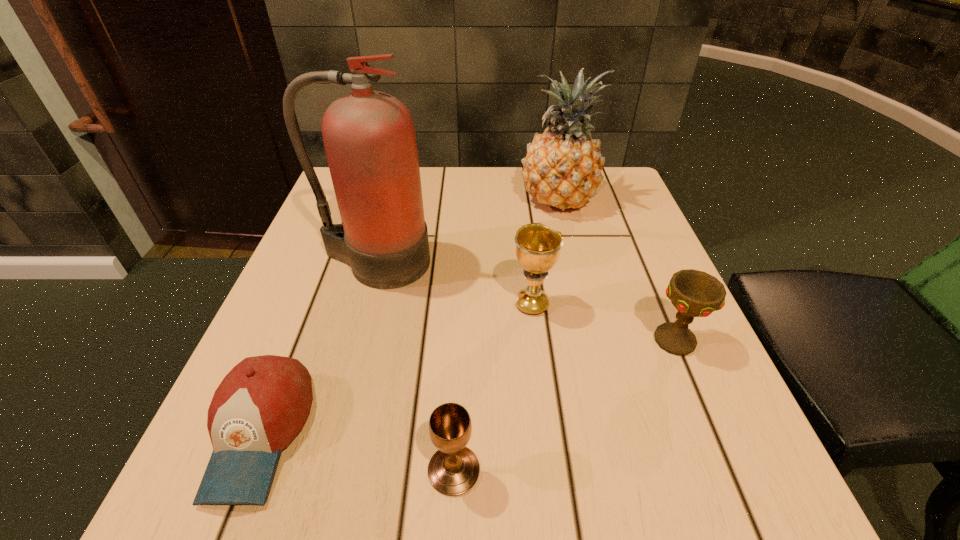
Image resolution: width=960 pixels, height=540 pixels. What are the coordinates of `free space between the nearest chalice and the tallest chalice` in the screenshot? It's located at (492, 387).

Locate an element on the screen. The height and width of the screenshot is (540, 960). free space between the shortest object and the second chalice from right to left is located at coordinates (396, 369).

Identify the location of free space between the leftmost chalice and the rightmost chalice. (564, 406).

Where is `vacant area that lies between the farthest chalice and the rightmost chalice`? The image size is (960, 540). vacant area that lies between the farthest chalice and the rightmost chalice is located at coordinates (603, 322).

The width and height of the screenshot is (960, 540). I want to click on vacant area between the third object from left to right and the farthest chalice, so click(x=492, y=387).

Locate an element on the screen. vacant space that's between the leftmost chalice and the farthest chalice is located at coordinates (492, 387).

Find the location of a particular element. unoccupied position between the baseball cap and the second nearest chalice is located at coordinates click(x=467, y=387).

You are a GUI agent. You are given a task and a screenshot of the screen. Output one action in this format:
    pyautogui.click(x=<x>, y=<y>)
    Task: Click on the blank region between the pineapple and the baseball cap
    The width and height of the screenshot is (960, 540).
    Given the screenshot: What is the action you would take?
    pyautogui.click(x=409, y=318)

Identify the location of object that stands as the third closest to the rightmost object. This screenshot has height=540, width=960. (453, 470).

Identify which object is the second closest to the shortest object. Please provide its 2D coordinates. Your answer should be formatted as a tuple, i.e. [(x, y)], where the tuple contains the x and y coordinates of a point satisfying the conditions above.

[(369, 137)]